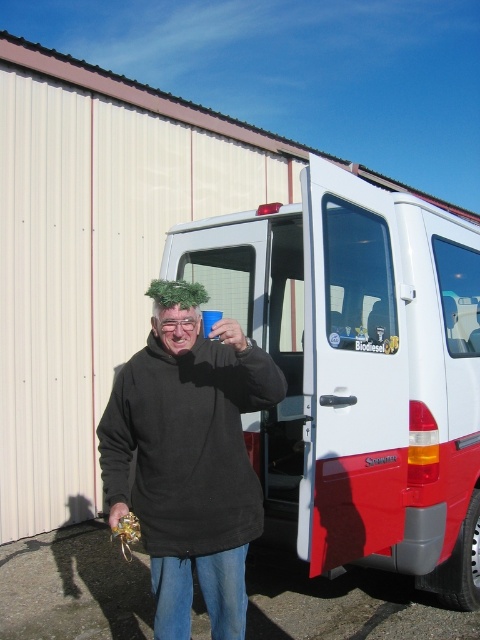
Which is above, white matte van at center or black fleece at center?

Positioned higher is white matte van at center.

Describe the element at coordinates (358, 372) in the screenshot. I see `white matte van at center` at that location.

Find the location of `white matte van at center`. white matte van at center is located at coordinates coord(358,372).